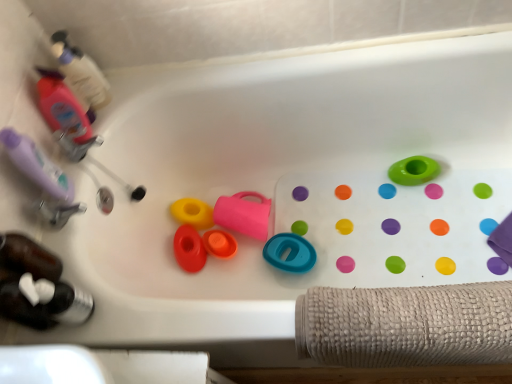
The height and width of the screenshot is (384, 512). I want to click on free space above beige textured towel at lower right (from a real-world perspective), so click(414, 319).